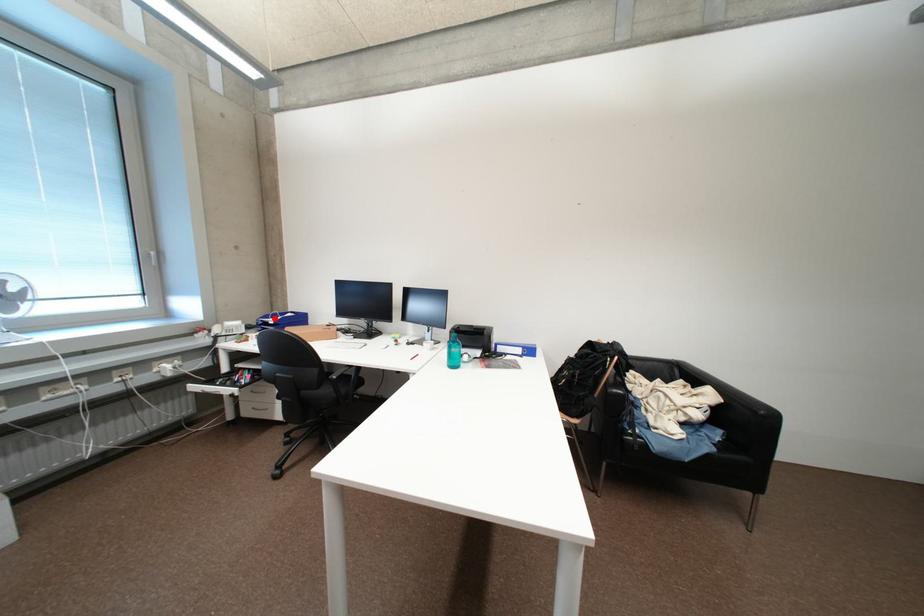
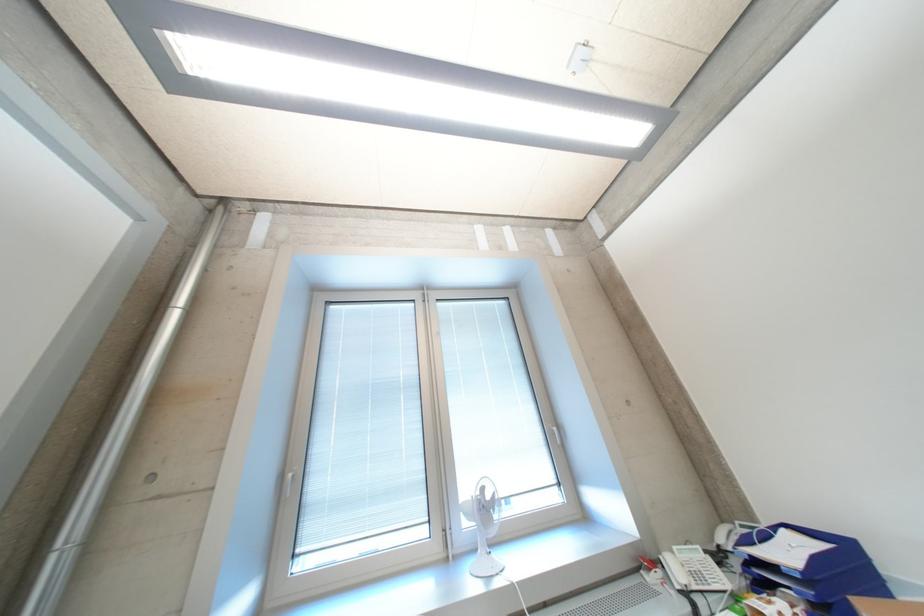
Locate, in the second image, the point that corresponds to the highlighted location in the first image.

(757, 543)